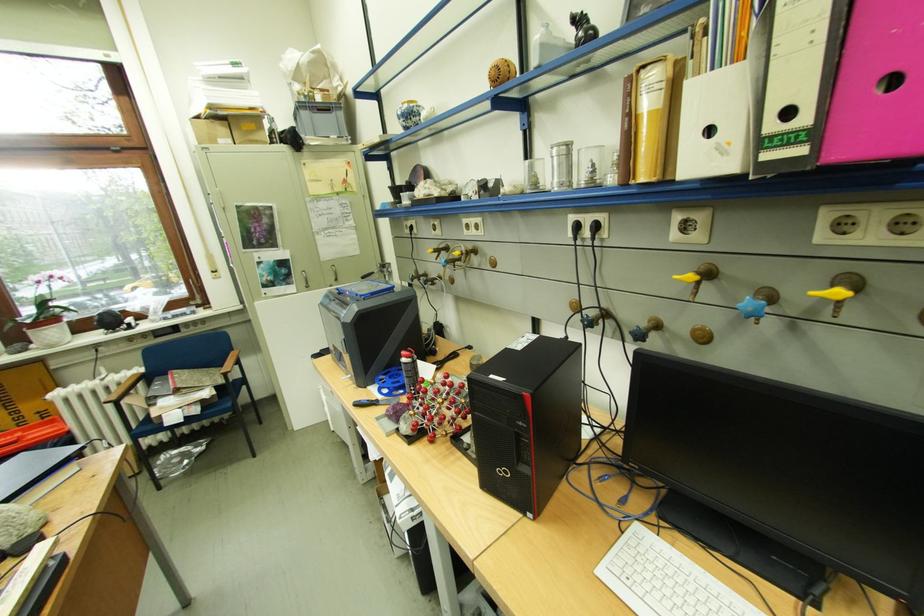
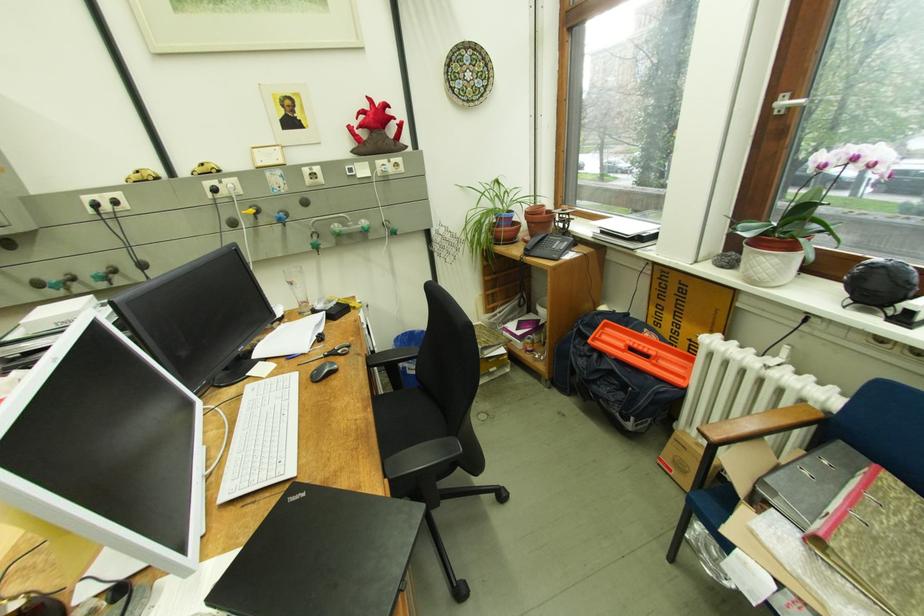
Where in the second image is the point corresponding to point (41, 334) from the first image?

(758, 249)